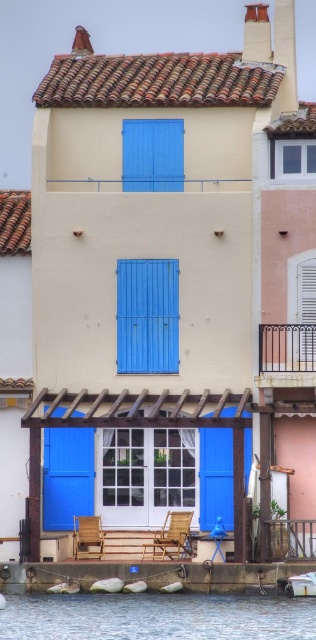
You are a painter who needs to decide which object to paint first based on their sizes. You see the blue matte door at center and the white matte boat at lower left. Which object should you paint first if you prefer to start with the taller one?

The blue matte door at center is taller than the white matte boat at lower left, so you should paint the blue matte door at center first.

You are a visitor arriving at the Mediterranean building and want to enter through the entrance. You see the blue matte door at center and the wooden at center. Which one should you approach to enter the building?

The blue matte door at center is the entrance, so you should approach the blue matte door at center to enter the building.

You are standing at the entrance of the two story building and want to locate the blue matte door at center. According to the coordinates provided, where should you look relative to your current position?

The blue matte door at center is located at coordinates point (66, 476), which means it is positioned to the right and slightly above your current position at the entrance.